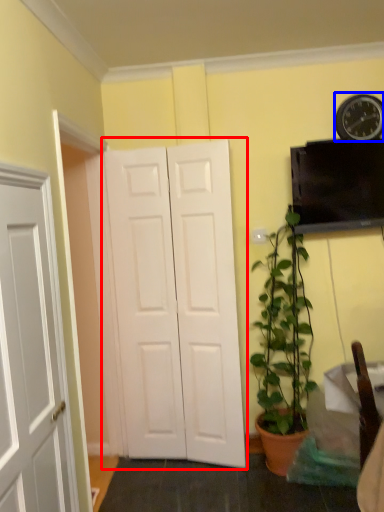
Question: Which point is closer to the camera, door (highlighted by a red box) or clock (highlighted by a blue box)?

Choices:
 (A) door
 (B) clock

Answer: (A)